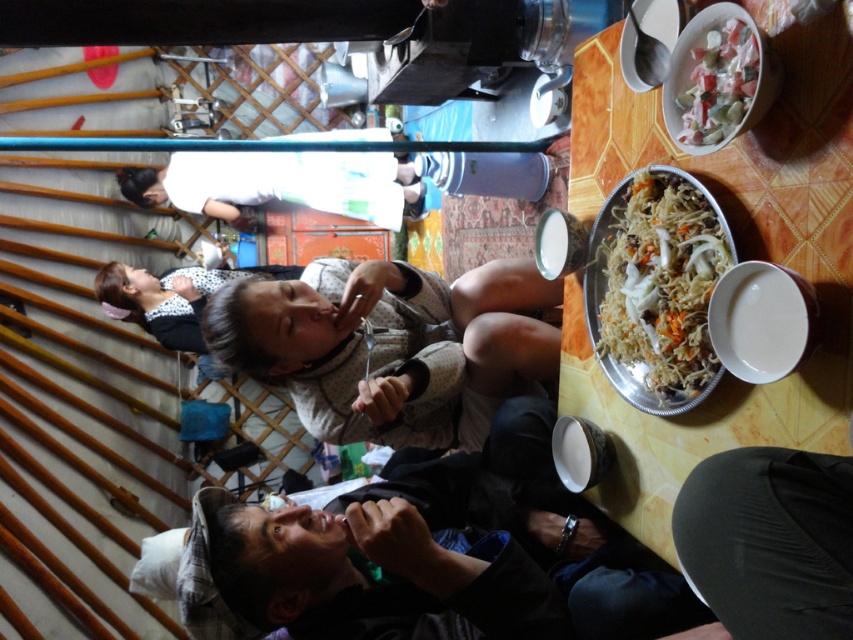
Question: Estimate the real-world distances between objects in this image. Which object is closer to the white rice pilaf at upper right?

Choices:
 (A) wooden table at right
 (B) shiny plastic bowl at upper right

Answer: (A)

Question: Is white rice pilaf at upper right to the right of shiny plastic bowl at upper right from the viewer's perspective?

Choices:
 (A) yes
 (B) no

Answer: (B)

Question: Can you confirm if wooden table at right is positioned to the left of shiny plastic bowl at upper right?

Choices:
 (A) yes
 (B) no

Answer: (A)

Question: Which of the following is the farthest from the observer?

Choices:
 (A) (598, 291)
 (B) (737, 74)
 (C) (830, 60)

Answer: (A)

Question: Does white rice pilaf at upper right appear under shiny plastic bowl at upper right?

Choices:
 (A) yes
 (B) no

Answer: (A)

Question: Which point is farther to the camera?

Choices:
 (A) white rice pilaf at upper right
 (B) shiny plastic bowl at upper right
 (C) wooden table at right

Answer: (A)